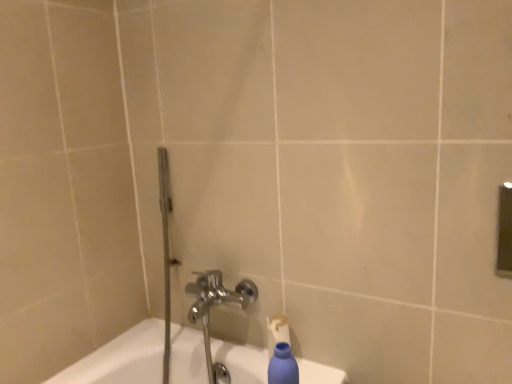
Locate an element on the screen. The image size is (512, 384). blue matte bottle at lower right is located at coordinates (283, 366).

What do you see at coordinates (283, 366) in the screenshot? The height and width of the screenshot is (384, 512). I see `blue matte bottle at lower right` at bounding box center [283, 366].

Measure the distance between blue matte bottle at lower right and camera.

The distance of blue matte bottle at lower right from camera is 91.08 centimeters.

Locate an element on the screen. Image resolution: width=512 pixels, height=384 pixels. blue matte bottle at lower right is located at coordinates (283, 366).